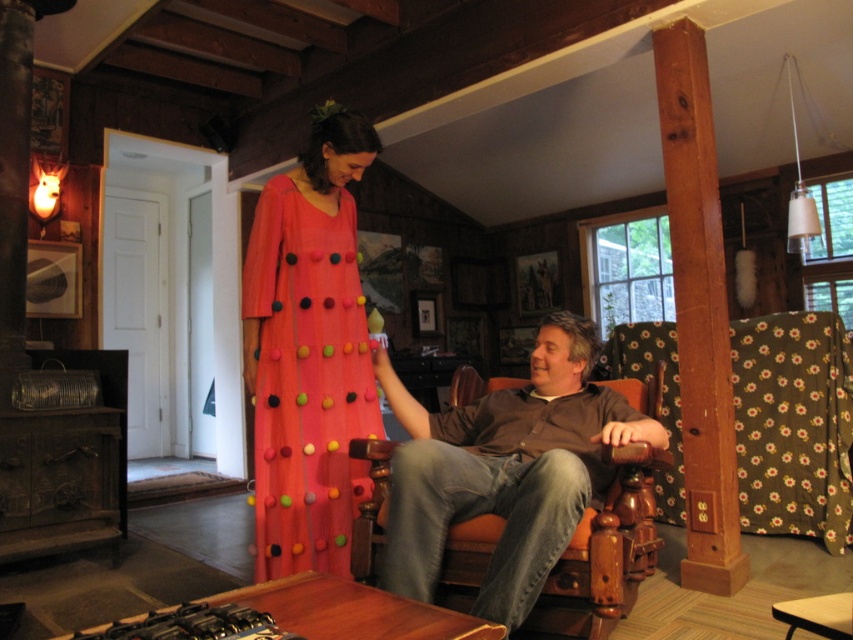
Question: Which point is closer to the camera?

Choices:
 (A) (544, 346)
 (B) (361, 342)

Answer: (A)

Question: Can you confirm if brown leather chair at center is smaller than matte coral dress at center?

Choices:
 (A) yes
 (B) no

Answer: (B)

Question: Is brown leather chair at center further to the viewer compared to matte coral dress at center?

Choices:
 (A) yes
 (B) no

Answer: (B)

Question: Does brown leather chair at center have a lesser width compared to matte coral dress at center?

Choices:
 (A) no
 (B) yes

Answer: (A)

Question: Which point is farther from the camera taking this photo?

Choices:
 (A) (268, 378)
 (B) (631, 442)

Answer: (A)

Question: Among these objects, which one is farthest from the camera?

Choices:
 (A) matte coral dress at center
 (B) brown leather chair at center

Answer: (A)